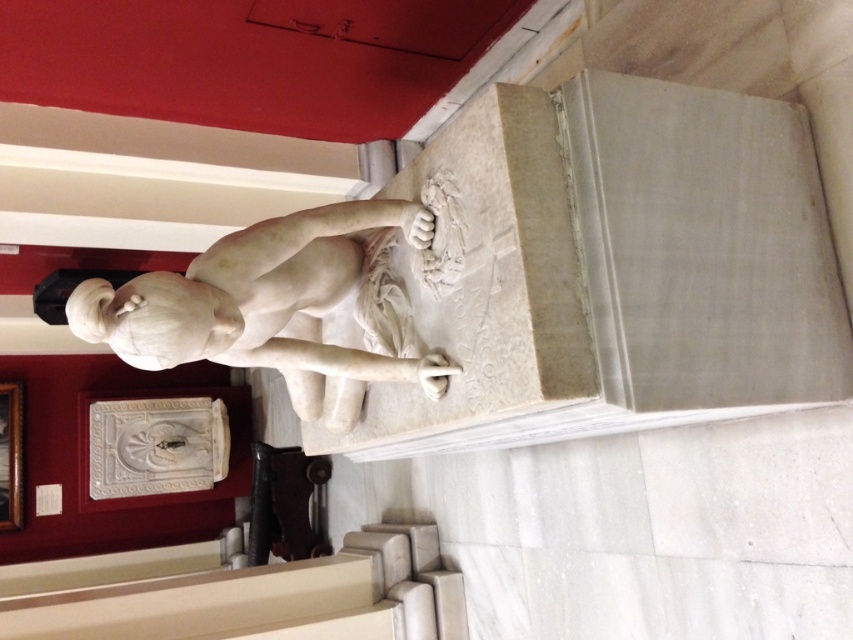
Between white marble stairs at lower left and white marble statue at center, which one has less height?

white marble stairs at lower left

Image resolution: width=853 pixels, height=640 pixels. What are the coordinates of `white marble stairs at lower left` in the screenshot? It's located at (242, 593).

Locate an element on the screen. The image size is (853, 640). white marble stairs at lower left is located at coordinates (242, 593).